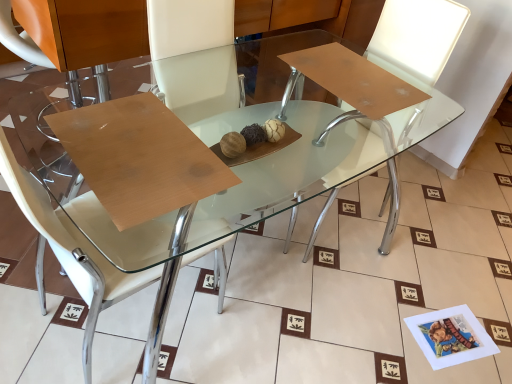
In order to click on free spot above wooden at center (from a real-world perspective) in this screenshot , I will do `click(137, 148)`.